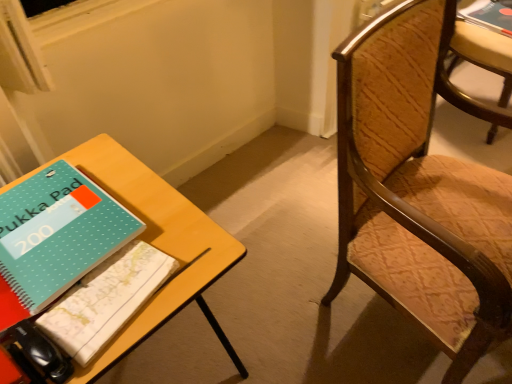
Question: Can you confirm if yellow wood table at lower left is taller than wooden textured chair at right, the second chair from the back?

Choices:
 (A) yes
 (B) no

Answer: (B)

Question: Is yellow wood table at lower left at the right side of wooden textured chair at right, the second chair from the back?

Choices:
 (A) no
 (B) yes

Answer: (A)

Question: From a real-world perspective, is yellow wood table at lower left over wooden textured chair at right, the second chair from the back?

Choices:
 (A) yes
 (B) no

Answer: (B)

Question: Is yellow wood table at lower left looking in the opposite direction of wooden textured chair at right, which ranks as the 1th chair in left-to-right order?

Choices:
 (A) yes
 (B) no

Answer: (B)

Question: From the image's perspective, is yellow wood table at lower left over wooden textured chair at right, acting as the 1th chair starting from the front?

Choices:
 (A) no
 (B) yes

Answer: (A)

Question: Considering their positions, is wooden textured chair at right, which is counted as the second chair, starting from the left, located in front of or behind wooden textured chair at right, acting as the 1th chair starting from the front?

Choices:
 (A) behind
 (B) front

Answer: (A)

Question: Considering the positions of point (502, 56) and point (356, 152), is point (502, 56) closer or farther from the camera than point (356, 152)?

Choices:
 (A) closer
 (B) farther

Answer: (B)

Question: Based on their sizes in the image, would you say wooden textured chair at right, which is counted as the second chair, starting from the left, is bigger or smaller than wooden textured chair at right, the 2th chair viewed from the right?

Choices:
 (A) small
 (B) big

Answer: (A)

Question: Is wooden textured chair at right, the first chair when ordered from back to front, inside the boundaries of wooden textured chair at right, acting as the 1th chair starting from the front, or outside?

Choices:
 (A) inside
 (B) outside

Answer: (B)

Question: Choose the correct answer: Is teal dotted notebook at lower left, positioned as the 2th book in right-to-left order, inside teal matte notebook at left, the 2th book when ordered from bottom to top, or outside it?

Choices:
 (A) outside
 (B) inside

Answer: (A)

Question: Is teal dotted notebook at lower left, positioned as the 3th book in back-to-front order, in front of or behind teal matte notebook at left, the 1th book from the left, in the image?

Choices:
 (A) behind
 (B) front

Answer: (B)

Question: Considering the positions of teal dotted notebook at lower left, positioned as the 3th book in back-to-front order, and teal matte notebook at left, the 1th book from the left, in the image, is teal dotted notebook at lower left, positioned as the 3th book in back-to-front order, wider or thinner than teal matte notebook at left, the 1th book from the left,?

Choices:
 (A) thin
 (B) wide

Answer: (A)

Question: From a real-world perspective, is teal dotted notebook at lower left, marked as the 2th book in a left-to-right arrangement, positioned above or below teal matte notebook at left, which appears as the second book when viewed from the front?

Choices:
 (A) below
 (B) above

Answer: (A)

Question: Would you say wooden textured chair at right, the first chair when ordered from back to front, is to the left or to the right of yellow wood table at lower left in the picture?

Choices:
 (A) right
 (B) left

Answer: (A)

Question: From their relative heights in the image, would you say wooden textured chair at right, which is counted as the second chair, starting from the left, is taller or shorter than yellow wood table at lower left?

Choices:
 (A) short
 (B) tall

Answer: (A)